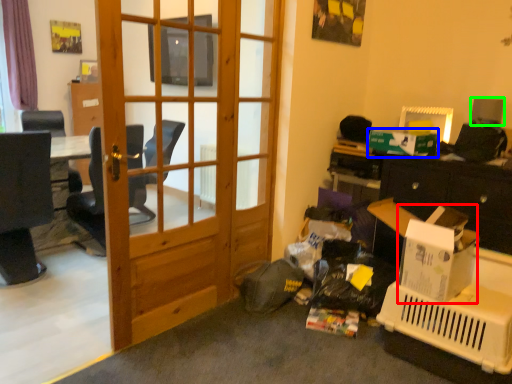
Question: Which object is the closest to the cardboard box (highlighted by a red box)? Choose among these: box (highlighted by a blue box) or loudspeaker (highlighted by a green box).

Choices:
 (A) box
 (B) loudspeaker

Answer: (A)